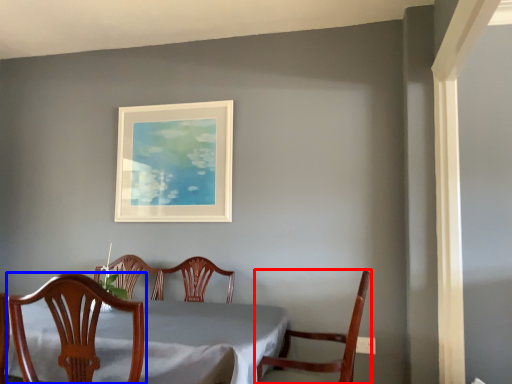
Question: Which object is further to the camera taking this photo, chair (highlighted by a red box) or chair (highlighted by a blue box)?

Choices:
 (A) chair
 (B) chair

Answer: (A)